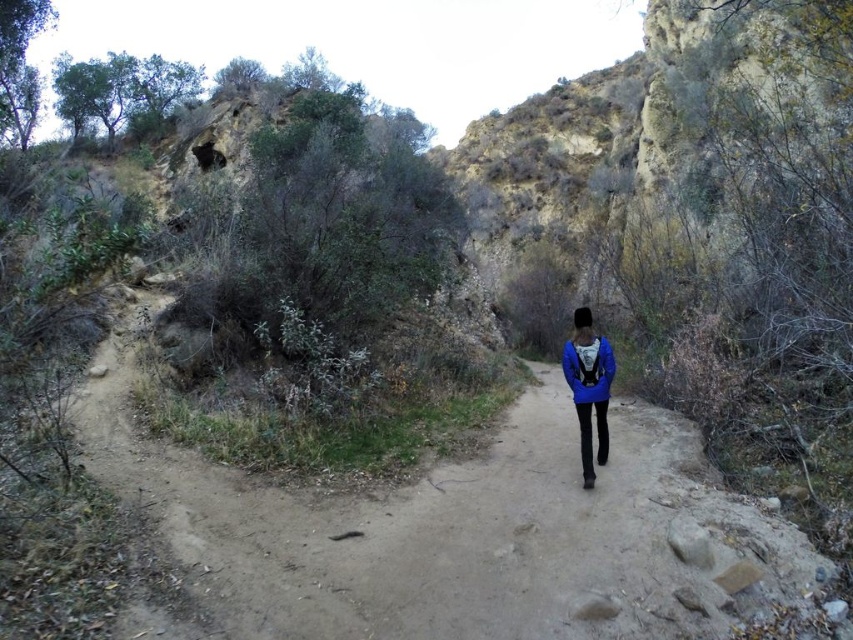
Question: Can you confirm if dirt path at center is positioned to the left of blue matte jacket at center?

Choices:
 (A) no
 (B) yes

Answer: (B)

Question: Can you confirm if dirt path at center is positioned above blue matte jacket at center?

Choices:
 (A) no
 (B) yes

Answer: (A)

Question: Where is dirt path at center located in relation to blue matte jacket at center in the image?

Choices:
 (A) left
 (B) right

Answer: (A)

Question: Which point is farther to the camera?

Choices:
 (A) dirt path at center
 (B) blue matte jacket at center

Answer: (B)